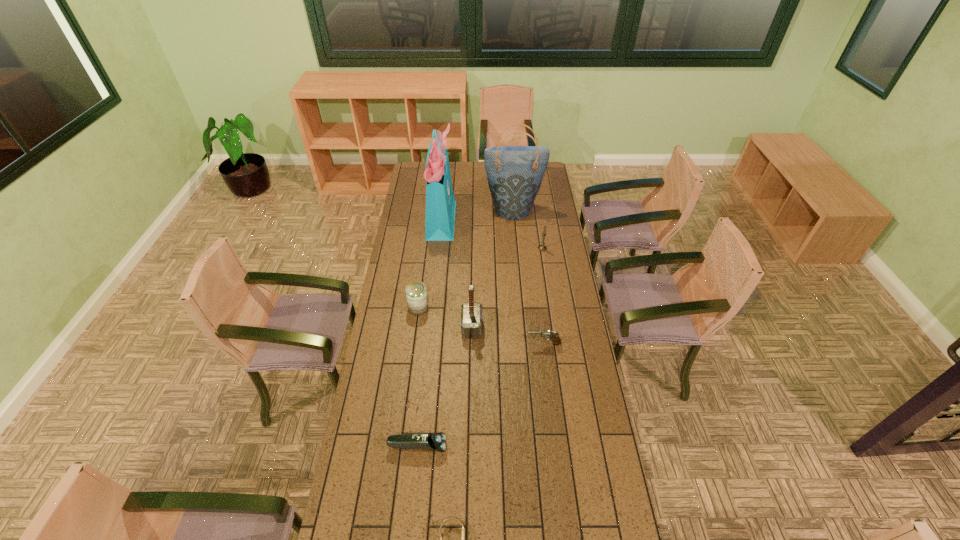
The image size is (960, 540). Identify the location of can present at the left edge. (416, 294).

At what (x,y) coordinates should I click in order to perform the action: click on electric shaver that is at the left edge. Please return your answer as a coordinate pair (x, y). The image size is (960, 540). Looking at the image, I should click on (434, 442).

Find the location of a particular element. shopping bag positioned at the right edge is located at coordinates (514, 173).

Where is `candle that is at the right edge`? This screenshot has height=540, width=960. candle that is at the right edge is located at coordinates (542, 247).

Locate an element on the screen. This screenshot has height=540, width=960. pistol that is at the right edge is located at coordinates (553, 336).

This screenshot has width=960, height=540. I want to click on free space at the left edge, so click(x=345, y=502).

This screenshot has width=960, height=540. In the image, there is a desktop. Identify the location of free region at the right edge. (537, 271).

In the image, there is a desktop. Where is `free region at the far left corner`? The width and height of the screenshot is (960, 540). free region at the far left corner is located at coordinates (416, 162).

At what (x,y) coordinates should I click in order to perform the action: click on free space between the third farthest object and the fifth tallest object. Please return your answer as a coordinate pair (x, y). This screenshot has height=540, width=960. Looking at the image, I should click on (480, 278).

I want to click on free spot between the left shopping bag and the sixth nearest object, so click(492, 233).